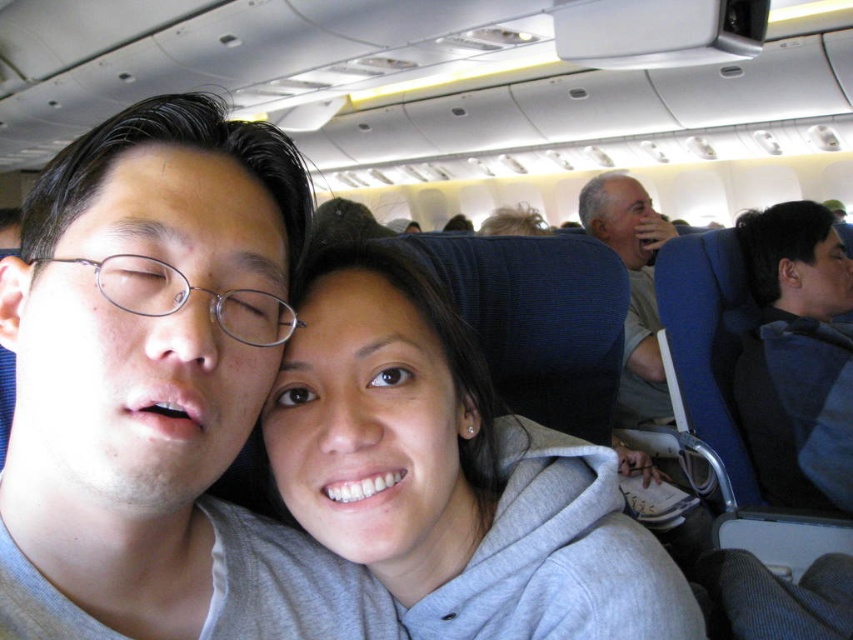
Who is more forward, (490, 515) or (642, 241)?

Point (490, 515) is in front.

Which is below, gray fleece at center or gray cotton shirt at upper right?

Positioned lower is gray fleece at center.

Does point (436, 528) come in front of point (648, 308)?

That is True.

You are a GUI agent. You are given a task and a screenshot of the screen. Output one action in this format:
    pyautogui.click(x=<x>, y=<y>)
    Task: Click on the gray fleece at center
    
    Given the screenshot: What is the action you would take?
    pyautogui.click(x=451, y=474)

Describe the element at coordinates (451, 474) in the screenshot. The height and width of the screenshot is (640, 853). I see `gray fleece at center` at that location.

Can you confirm if gray fleece at center is positioned below dark blue fabric at right?

Indeed, gray fleece at center is positioned under dark blue fabric at right.

This screenshot has width=853, height=640. Describe the element at coordinates (451, 474) in the screenshot. I see `gray fleece at center` at that location.

Where is `gray fleece at center`? The height and width of the screenshot is (640, 853). gray fleece at center is located at coordinates (451, 474).

What do you see at coordinates (157, 390) in the screenshot? This screenshot has height=640, width=853. I see `matte gray hoodie at center` at bounding box center [157, 390].

Can you confirm if matte gray hoodie at center is bigger than dark blue fabric at right?

Actually, matte gray hoodie at center might be smaller than dark blue fabric at right.

Who is more distant from viewer, [138,449] or [762,378]?

Point [762,378]

Identify the location of matte gray hoodie at center. click(157, 390).